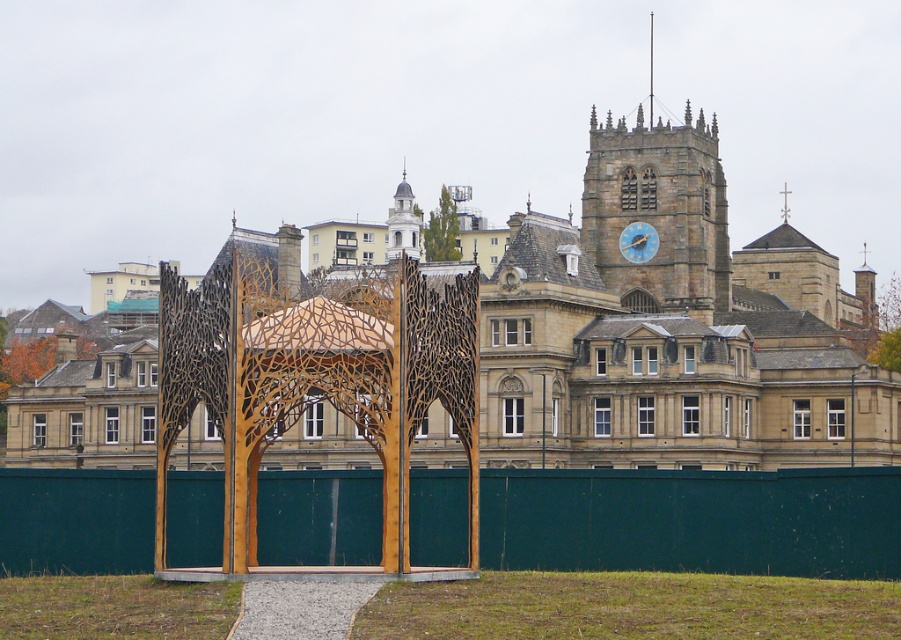
Does wooden lattice gazebo at center have a lesser width compared to stone clock tower at upper right?

Incorrect, wooden lattice gazebo at center's width is not less than stone clock tower at upper right's.

Which of these two, wooden lattice gazebo at center or stone clock tower at upper right, stands taller?

stone clock tower at upper right is taller.

What do you see at coordinates (314, 378) in the screenshot?
I see `wooden lattice gazebo at center` at bounding box center [314, 378].

This screenshot has height=640, width=901. Find the location of `wooden lattice gazebo at center`. wooden lattice gazebo at center is located at coordinates (314, 378).

Is green wooden fence at center above blue painted wood clock at center?

No, green wooden fence at center is not above blue painted wood clock at center.

Can you confirm if green wooden fence at center is positioned below blue painted wood clock at center?

Indeed, green wooden fence at center is positioned under blue painted wood clock at center.

Who is more distant from viewer, [730,561] or [635,260]?

The point [635,260] is more distant.

Locate an element on the screen. The width and height of the screenshot is (901, 640). green wooden fence at center is located at coordinates (694, 520).

Who is positioned more to the right, green wooden fence at center or wooden lattice gazebo at center?

From the viewer's perspective, green wooden fence at center appears more on the right side.

Does green wooden fence at center appear under wooden lattice gazebo at center?

Yes, green wooden fence at center is below wooden lattice gazebo at center.

Between point (325, 480) and point (190, 326), which one is positioned behind?

The point (325, 480) is more distant.

Where is `green wooden fence at center`? green wooden fence at center is located at coordinates (694, 520).